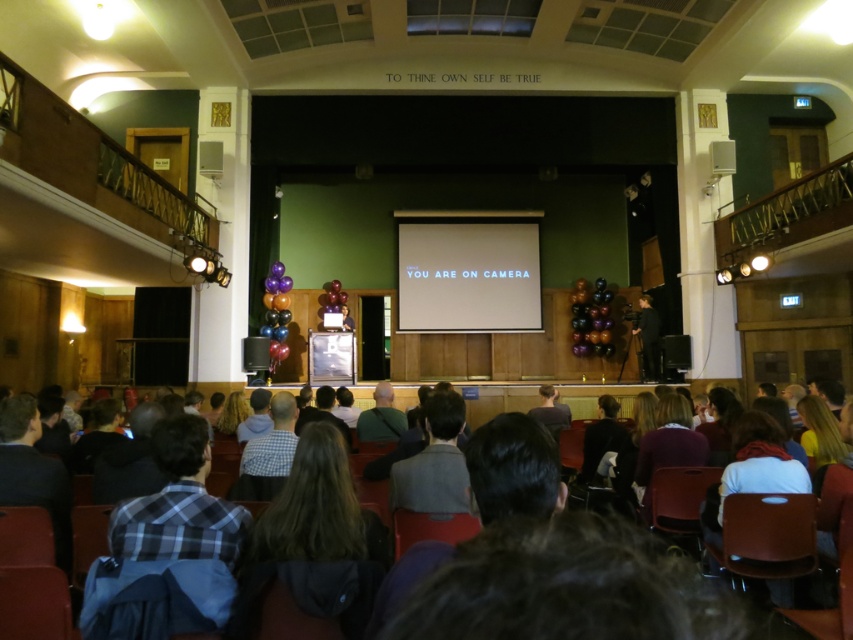
Can you confirm if white glossy projection screen at center is shorter than green fabric bag at center?

Incorrect, white glossy projection screen at center's height does not fall short of green fabric bag at center's.

Is the position of white glossy projection screen at center more distant than that of green fabric bag at center?

Yes, white glossy projection screen at center is behind green fabric bag at center.

Who is more forward, (512, 250) or (369, 440)?

Point (369, 440) is more forward.

Where is `white glossy projection screen at center`? This screenshot has width=853, height=640. white glossy projection screen at center is located at coordinates (468, 276).

Between point (444, 634) and point (469, 275), which one is positioned in front?

Positioned in front is point (444, 634).

You are a GUI agent. You are given a task and a screenshot of the screen. Output one action in this format:
    pyautogui.click(x=<x>, y=<y>)
    Task: Click on the dark brown wood chairs at lower center
    
    Given the screenshot: What is the action you would take?
    pyautogui.click(x=553, y=586)

The image size is (853, 640). I want to click on dark brown wood chairs at lower center, so click(x=553, y=586).

Which is in front, point (440, 541) or point (367, 435)?

Positioned in front is point (440, 541).

Find the location of a particular element. This screenshot has width=853, height=640. dark brown wood chairs at lower center is located at coordinates (553, 586).